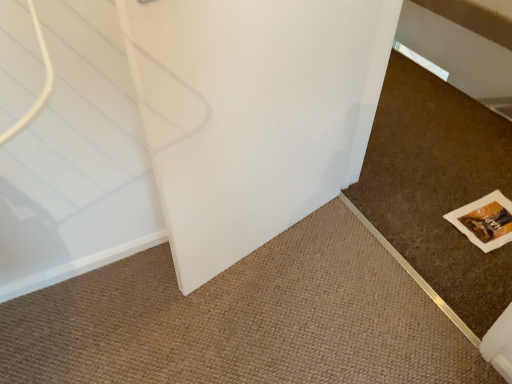
Find the location of a particular element. This screenshot has width=512, height=384. white paper magazine at lower right is located at coordinates (485, 221).

This screenshot has width=512, height=384. What do you see at coordinates (485, 221) in the screenshot?
I see `white paper magazine at lower right` at bounding box center [485, 221].

Identify the location of white paper magazine at lower right. [x=485, y=221].